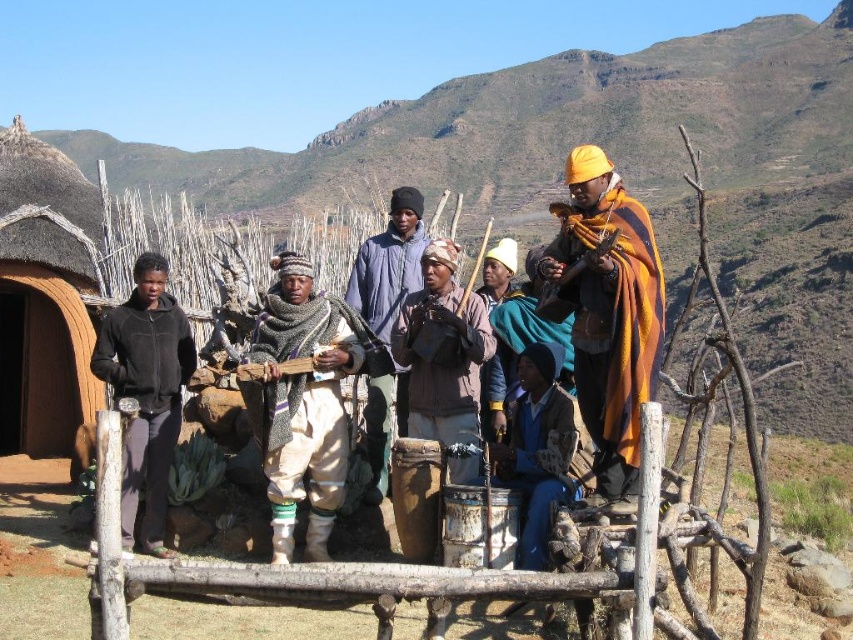
From the picture: Is knitted woolen scarf at center positioned in front of wooden fence at center?

No, it is not.

Which is behind, point (294, 515) or point (86, 304)?

The point (86, 304) is behind.

This screenshot has width=853, height=640. Find the location of `knitted woolen scarf at center`. knitted woolen scarf at center is located at coordinates (305, 400).

Where is `knitted woolen scarf at center`? knitted woolen scarf at center is located at coordinates (305, 400).

Between point (614, 189) and point (378, 323), which one is positioned in front?

Point (614, 189) is in front.

Is point (589, 401) in front of point (419, 273)?

Yes, point (589, 401) is in front of point (419, 273).

Where is `orange woolen shawl at center`? orange woolen shawl at center is located at coordinates (607, 310).

Is orange woolen shawl at center above wooden fence at center?

Actually, orange woolen shawl at center is below wooden fence at center.

In the scene shown: Which is below, orange woolen shawl at center or wooden fence at center?

orange woolen shawl at center is lower down.

Is point (590, 205) farther from camera compared to point (694, 150)?

No, (590, 205) is closer to viewer.

The width and height of the screenshot is (853, 640). I want to click on orange woolen shawl at center, so click(607, 310).